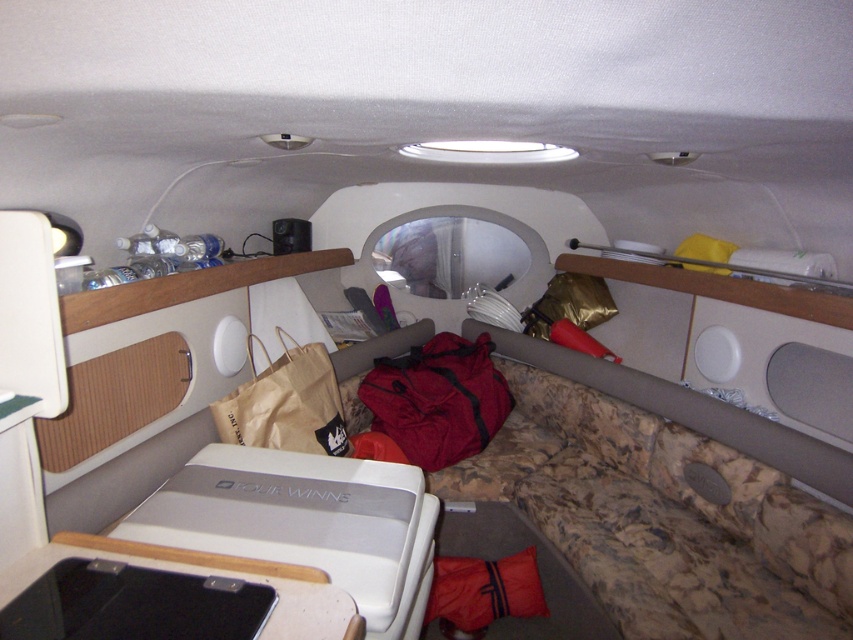
You are a photographer who needs to reach your camera to capture a sunset while on the boat. You are currently standing next to the red fabric bag at center. Can you comfortably reach the camera without moving from your current position?

The red fabric bag at center and the camera are 2.26 meters apart. Since 2.26 meters is a considerable distance, you would not be able to comfortably reach the camera from the red fabric bag at center without moving.

You are inside the boat cabin and need to reach both the red fabric bag at center and the brown paper bag at center. Which bag should you move first to access the other?

You should move the red fabric bag at center first because it is closer to you and blocking the brown paper bag at center, which is behind it.

In the scene shown: You are organizing the items in the boat cabin and need to place both the red fabric bag at center and the brown paper bag at center into a storage compartment. Which bag should you place first to ensure both fit?

The red fabric bag at center is larger in size than the brown paper bag at center, so you should place the red fabric bag at center first to make space for the smaller brown paper bag at center.